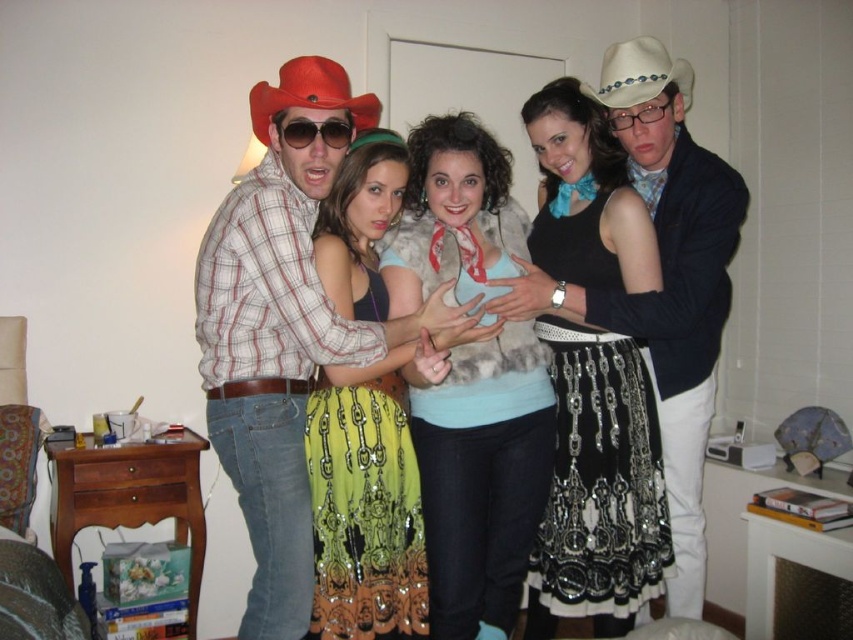
The height and width of the screenshot is (640, 853). I want to click on matte plaid shirt at center, so click(x=281, y=333).

Who is more distant from viewer, (265, 244) or (253, 88)?

The point (253, 88) is behind.

Locate an element on the screen. matte plaid shirt at center is located at coordinates (281, 333).

Who is shorter, white matte cowboy hat at right or black plastic glasses at center?

black plastic glasses at center is shorter.

In the scene shown: Can you confirm if white matte cowboy hat at right is bigger than black plastic glasses at center?

Correct, white matte cowboy hat at right is larger in size than black plastic glasses at center.

Is point (682, 483) less distant than point (624, 120)?

That is False.

Find the location of a particular element. white matte cowboy hat at right is located at coordinates (674, 282).

Can you confirm if matte plaid shirt at center is thinner than white matte cowboy hat at right?

No, matte plaid shirt at center is not thinner than white matte cowboy hat at right.

Measure the distance between matte plaid shirt at center and camera.

5.61 feet

Is point (245, 515) less distant than point (659, 305)?

Yes, it is in front of point (659, 305).

Image resolution: width=853 pixels, height=640 pixels. I want to click on matte plaid shirt at center, so click(x=281, y=333).